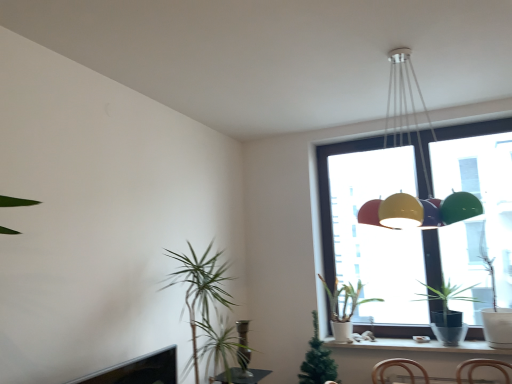
Question: Are white ceramic window sill at lower right and transparent glass window at upper right far apart?

Choices:
 (A) yes
 (B) no

Answer: (B)

Question: From the image's perspective, would you say white ceramic window sill at lower right is positioned over transparent glass window at upper right?

Choices:
 (A) no
 (B) yes

Answer: (A)

Question: Considering the relative sizes of white ceramic window sill at lower right and transparent glass window at upper right in the image provided, is white ceramic window sill at lower right taller than transparent glass window at upper right?

Choices:
 (A) yes
 (B) no

Answer: (B)

Question: Is white ceramic window sill at lower right smaller than transparent glass window at upper right?

Choices:
 (A) yes
 (B) no

Answer: (A)

Question: Does white ceramic window sill at lower right have a larger size compared to transparent glass window at upper right?

Choices:
 (A) no
 (B) yes

Answer: (A)

Question: In terms of height, does metallic pendant light at upper center look taller or shorter compared to green glossy houseplant at window, which ranks as the 3th houseplant in left-to-right order?

Choices:
 (A) short
 (B) tall

Answer: (B)

Question: Is metallic pendant light at upper center in front of or behind green glossy houseplant at window, the 1th houseplant viewed from the right, in the image?

Choices:
 (A) front
 (B) behind

Answer: (A)

Question: Do you think metallic pendant light at upper center is within green glossy houseplant at window, which ranks as the 3th houseplant in left-to-right order, or outside of it?

Choices:
 (A) outside
 (B) inside

Answer: (A)

Question: Does point (394, 226) appear closer or farther from the camera than point (435, 334)?

Choices:
 (A) farther
 (B) closer

Answer: (B)

Question: Considering the positions of white matte pot at window, the 2th houseplant from the left, and white ceramic window sill at lower right in the image, is white matte pot at window, the 2th houseplant from the left, wider or thinner than white ceramic window sill at lower right?

Choices:
 (A) wide
 (B) thin

Answer: (A)

Question: From a real-world perspective, relative to white ceramic window sill at lower right, is white matte pot at window, the 2th houseplant from the left, vertically above or below?

Choices:
 (A) above
 (B) below

Answer: (A)

Question: In terms of height, does white matte pot at window, which is the second houseplant in right-to-left order, look taller or shorter compared to white ceramic window sill at lower right?

Choices:
 (A) tall
 (B) short

Answer: (A)

Question: Is white matte pot at window, the 2th houseplant from the left, inside or outside of white ceramic window sill at lower right?

Choices:
 (A) outside
 (B) inside

Answer: (A)

Question: From the image's perspective, is green glossy houseplant at window, the 1th houseplant viewed from the right, located above or below white matte pot at window, which is the second houseplant in right-to-left order?

Choices:
 (A) below
 (B) above

Answer: (B)

Question: Is green glossy houseplant at window, which ranks as the 3th houseplant in left-to-right order, wider or thinner than white matte pot at window, the 2th houseplant from the left?

Choices:
 (A) wide
 (B) thin

Answer: (A)